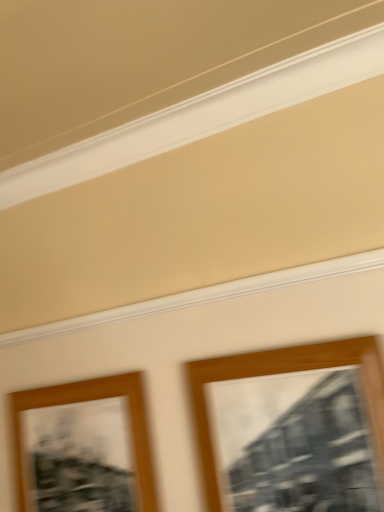
Question: In terms of width, does wooden picture frame at center, which appears as the 1th picture frame when viewed from the front, look wider or thinner when compared to wooden picture frame at lower left, which is the first picture frame from left to right?

Choices:
 (A) thin
 (B) wide

Answer: (B)

Question: In terms of size, does wooden picture frame at center, which ranks as the second picture frame in left-to-right order, appear bigger or smaller than wooden picture frame at lower left, placed as the 2th picture frame when sorted from right to left?

Choices:
 (A) small
 (B) big

Answer: (B)

Question: From the image's perspective, relative to wooden picture frame at lower left, placed as the 2th picture frame when sorted from right to left, is wooden picture frame at center, the 1th picture frame from the right, above or below?

Choices:
 (A) above
 (B) below

Answer: (A)

Question: From a real-world perspective, relative to wooden picture frame at center, which ranks as the second picture frame in left-to-right order, is wooden picture frame at lower left, arranged as the 2th picture frame when viewed from the front, vertically above or below?

Choices:
 (A) above
 (B) below

Answer: (B)

Question: Considering the positions of wooden picture frame at lower left, which is the first picture frame from left to right, and wooden picture frame at center, the 2th picture frame when ordered from back to front, in the image, is wooden picture frame at lower left, which is the first picture frame from left to right, taller or shorter than wooden picture frame at center, the 2th picture frame when ordered from back to front,?

Choices:
 (A) tall
 (B) short

Answer: (B)

Question: Based on their sizes in the image, would you say wooden picture frame at lower left, which is the 1th picture frame in back-to-front order, is bigger or smaller than wooden picture frame at center, which ranks as the second picture frame in left-to-right order?

Choices:
 (A) big
 (B) small

Answer: (B)

Question: Does point (31, 504) appear closer or farther from the camera than point (379, 441)?

Choices:
 (A) farther
 (B) closer

Answer: (A)